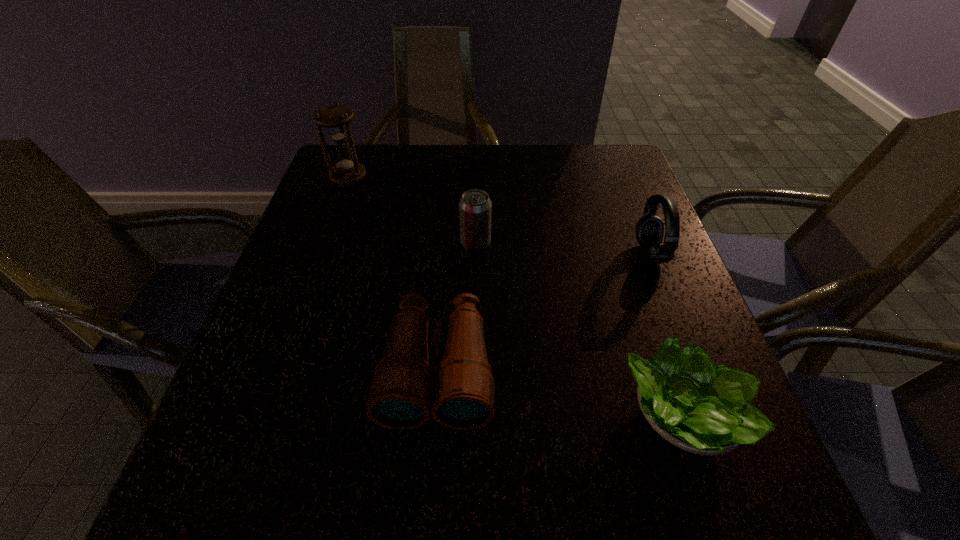
Where is `free space between the farthest object and the lettuce`? The image size is (960, 540). free space between the farthest object and the lettuce is located at coordinates (516, 296).

Where is `free space between the hourglass and the binoculars`? This screenshot has height=540, width=960. free space between the hourglass and the binoculars is located at coordinates (393, 274).

What are the coordinates of `free spot between the farthest object and the soda can` in the screenshot? It's located at (412, 210).

Locate an element on the screen. free point between the headset and the soda can is located at coordinates (563, 248).

Where is `free spot between the binoculars and the farthest object`? free spot between the binoculars and the farthest object is located at coordinates (393, 274).

The width and height of the screenshot is (960, 540). Identify the location of empty space between the binoculars and the hourglass. (393, 274).

I want to click on object that ranks as the second closest to the soda can, so click(x=335, y=118).

Identify the location of the third closest object to the tallest object. The image size is (960, 540). (649, 230).

I want to click on vacant space that satisfies the following two spatial constraints: 1. on the earcups of the headset; 2. through the lenses of the binoculars, so click(x=695, y=370).

The height and width of the screenshot is (540, 960). I want to click on vacant position in the image that satisfies the following two spatial constraints: 1. on the front side of the hourglass; 2. on the left side of the lettuce, so click(260, 416).